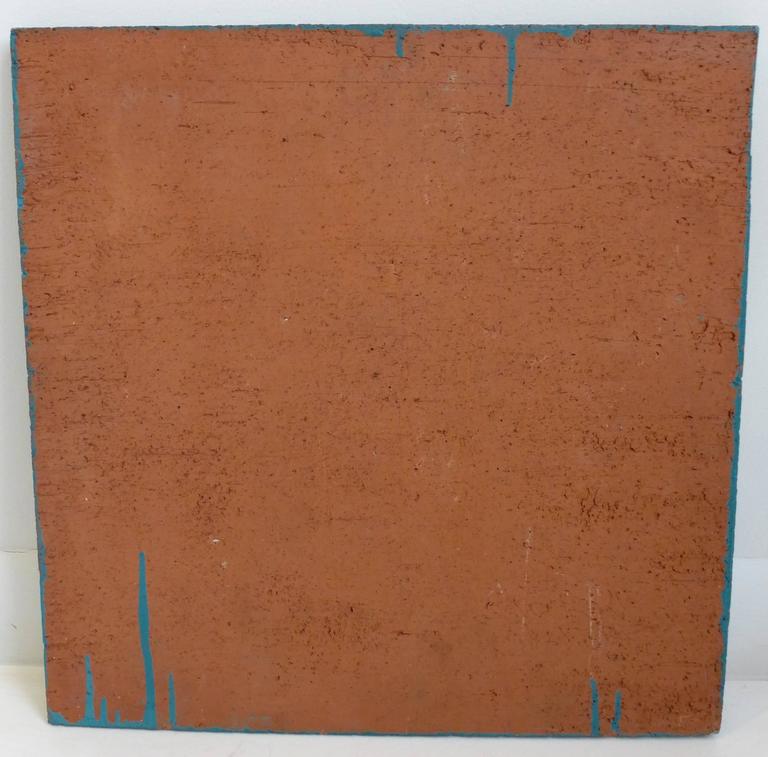
You are a GUI agent. You are given a task and a screenshot of the screen. Output one action in this format:
    pyautogui.click(x=<x>, y=<y>)
    Task: Click on the white surface
    The height and width of the screenshot is (757, 768).
    Given the screenshot: What is the action you would take?
    pyautogui.click(x=750, y=729)